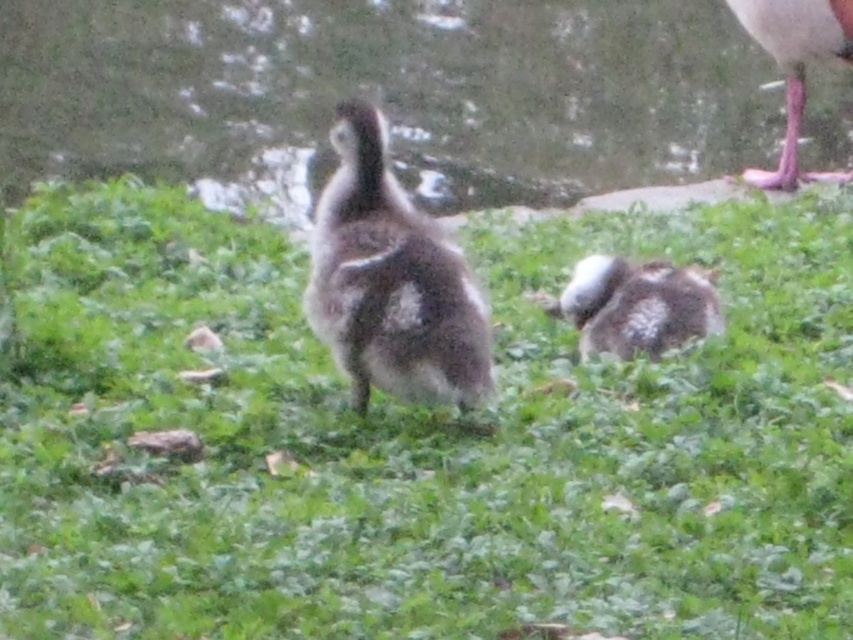
Question: Does green grassy area at center have a lesser width compared to pink rubber duck at upper right?

Choices:
 (A) no
 (B) yes

Answer: (A)

Question: Which object is closer to the camera taking this photo?

Choices:
 (A) green fuzzy grass at center
 (B) gray downy duckling at center
 (C) green grassy area at center

Answer: (A)

Question: Can you confirm if green grassy area at center is smaller than pink rubber duck at upper right?

Choices:
 (A) no
 (B) yes

Answer: (A)

Question: Does green fuzzy grass at center appear on the right side of green grassy area at center?

Choices:
 (A) yes
 (B) no

Answer: (A)

Question: Which point is closer to the camera taking this photo?

Choices:
 (A) (135, 156)
 (B) (843, 26)
 (C) (236, 572)
 (D) (376, 264)

Answer: (C)

Question: Considering the real-world distances, which object is farthest from the green grassy area at center?

Choices:
 (A) green fuzzy grass at center
 (B) gray downy duckling at center

Answer: (B)